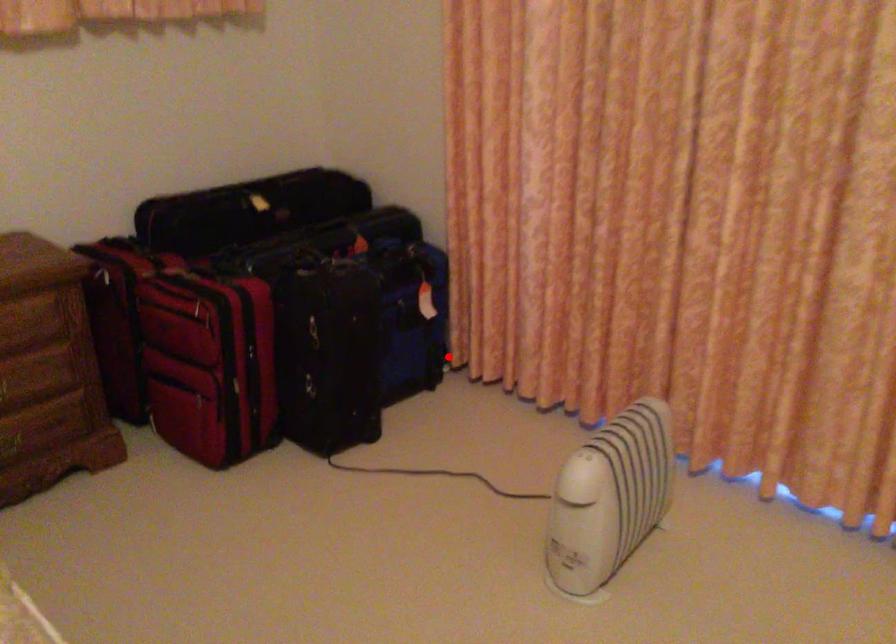
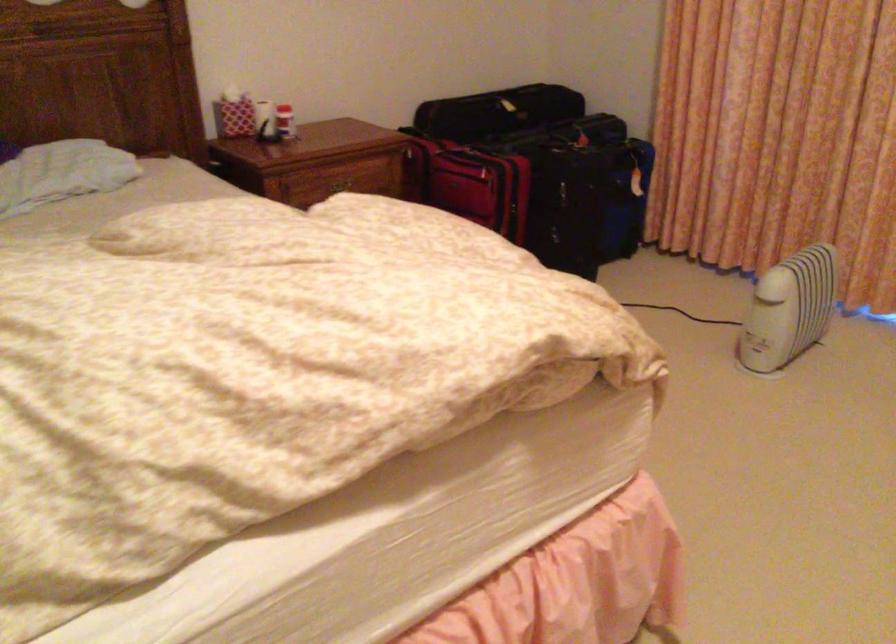
The point at the highlighted location is marked in the first image. Where is the corresponding point in the second image?

(649, 223)